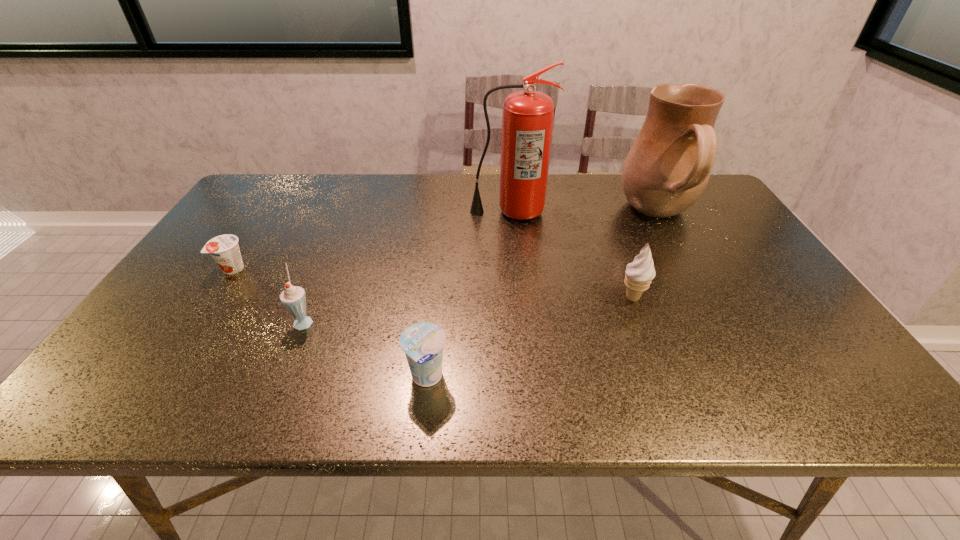
Locate an element on the screen. the left yogurt is located at coordinates (225, 250).

At what (x,y) coordinates should I click in order to perform the action: click on the shortest object. Please return your answer as a coordinate pair (x, y). Looking at the image, I should click on (225, 250).

You are a GUI agent. You are given a task and a screenshot of the screen. Output one action in this format:
    pyautogui.click(x=<x>, y=<y>)
    Task: Click on the vacant space located 0.360m on the instruction side of the tallest object
    This screenshot has width=960, height=540.
    Given the screenshot: What is the action you would take?
    pyautogui.click(x=519, y=308)

Where is `free region located 0.330m at the spout of the cream pitcher`? This screenshot has height=540, width=960. free region located 0.330m at the spout of the cream pitcher is located at coordinates (515, 215).

At what (x,y) coordinates should I click in order to perform the action: click on vacant region located 0.380m at the spout of the cream pitcher. Please return your answer as a coordinate pair (x, y). Looking at the image, I should click on (498, 215).

At what (x,y) coordinates should I click in order to perform the action: click on vacant space located 0.250m at the spout of the cream pitcher. Please return your answer as a coordinate pair (x, y). Looking at the image, I should click on (540, 215).

You are a GUI agent. You are given a task and a screenshot of the screen. Output one action in this format:
    pyautogui.click(x=<x>, y=<y>)
    Task: Click on the vacant point located on the front-facing side of the second object from right to left
    The width and height of the screenshot is (960, 540).
    Given the screenshot: What is the action you would take?
    pyautogui.click(x=470, y=298)

The height and width of the screenshot is (540, 960). Identify the location of vacant region located on the front-facing side of the second object from right to left. (491, 298).

Where is `vacant point located 0.200m on the front-facing side of the second object from right to left`? vacant point located 0.200m on the front-facing side of the second object from right to left is located at coordinates (539, 298).

This screenshot has height=540, width=960. In order to click on blank area located on the straw side of the milkshake in this screenshot , I will do `click(404, 320)`.